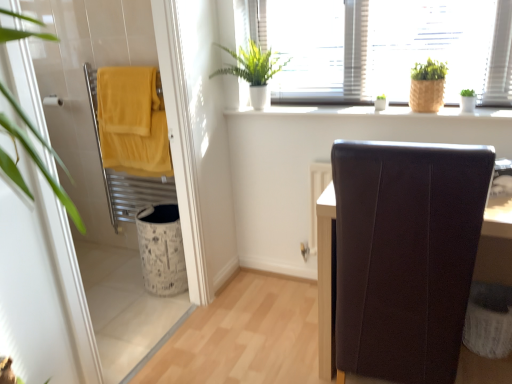
The width and height of the screenshot is (512, 384). Describe the element at coordinates (326, 280) in the screenshot. I see `brown leather chair at right` at that location.

Where is `green matte plant at upper right, the 1th houseplant positioned from the right`? This screenshot has height=384, width=512. green matte plant at upper right, the 1th houseplant positioned from the right is located at coordinates (467, 100).

What is the approximate width of white textured laundry basket at lower right?

white textured laundry basket at lower right is 10.77 inches wide.

Find the location of a particular element. This screenshot has height=384, width=512. white textured laundry basket at lower right is located at coordinates click(489, 320).

Image resolution: width=512 pixels, height=384 pixels. What do you see at coordinates (370, 112) in the screenshot?
I see `white ceramic window sill at upper center` at bounding box center [370, 112].

What do you see at coordinates (86, 91) in the screenshot?
I see `matte yellow towel at left` at bounding box center [86, 91].

Locate an element on the screen. brown leather chair at right is located at coordinates pyautogui.click(x=326, y=280).

Is green leafy plant at upper center, the 3th houseplant positioned from the right, surrounded by green matte plant at upper right, the 1th houseplant positioned from the right?

No, green leafy plant at upper center, the 3th houseplant positioned from the right, is not a part of green matte plant at upper right, the 1th houseplant positioned from the right.

Can you confirm if green matte plant at upper right, the 1th houseplant positioned from the right, is thinner than green leafy plant at upper center, the first houseplant from the left?

Indeed, green matte plant at upper right, the 1th houseplant positioned from the right, has a lesser width compared to green leafy plant at upper center, the first houseplant from the left.

Is there a large distance between green matte plant at upper right, which is the 3th houseplant in left-to-right order, and green leafy plant at upper center, the 3th houseplant positioned from the right?

That's not correct — green matte plant at upper right, which is the 3th houseplant in left-to-right order, is a little close to green leafy plant at upper center, the 3th houseplant positioned from the right.

Is brown leather chair at right further to the viewer compared to matte yellow towel at left?

No, brown leather chair at right is in front of matte yellow towel at left.

How far apart are brown leather chair at right and matte yellow towel at left?

brown leather chair at right is 4.01 feet from matte yellow towel at left.

Does brown leather chair at right touch matte yellow towel at left?

No, brown leather chair at right is not next to matte yellow towel at left.

Is matte yellow towel at left at the back of brown leather chair at right?

brown leather chair at right is not turned away from matte yellow towel at left.

Where is `the 2nd houseplant in front of the green leafy plant at upper center, the first houseplant from the left, starting your count from the anchor`? the 2nd houseplant in front of the green leafy plant at upper center, the first houseplant from the left, starting your count from the anchor is located at coordinates (426, 86).

Considering the sizes of green leafy plant at upper center, the first houseplant from the left, and bamboo textured pot at upper right, acting as the second houseplant starting from the right, in the image, is green leafy plant at upper center, the first houseplant from the left, wider or thinner than bamboo textured pot at upper right, acting as the second houseplant starting from the right,?

Clearly, green leafy plant at upper center, the first houseplant from the left, has more width compared to bamboo textured pot at upper right, acting as the second houseplant starting from the right.

Which point is more forward, (252, 48) or (437, 86)?

The point (437, 86) is in front.

Who is taller, green leafy plant at upper center, the 3th houseplant positioned from the right, or bamboo textured pot at upper right, acting as the second houseplant starting from the right?

Standing taller between the two is green leafy plant at upper center, the 3th houseplant positioned from the right.

Considering the sizes of objects matte yellow towel at left and green matte plant at upper right, the 1th houseplant positioned from the right, in the image provided, who is taller, matte yellow towel at left or green matte plant at upper right, the 1th houseplant positioned from the right,?

Standing taller between the two is matte yellow towel at left.

From a real-world perspective, does matte yellow towel at left sit lower than green matte plant at upper right, which is the 3th houseplant in left-to-right order?

Correct, in the physical world, matte yellow towel at left is lower than green matte plant at upper right, which is the 3th houseplant in left-to-right order.

Is matte yellow towel at left oriented towards green matte plant at upper right, which is the 3th houseplant in left-to-right order?

No, matte yellow towel at left does not turn towards green matte plant at upper right, which is the 3th houseplant in left-to-right order.

Considering the sizes of objects matte yellow towel at left and green matte plant at upper right, which is the 3th houseplant in left-to-right order, in the image provided, who is smaller, matte yellow towel at left or green matte plant at upper right, which is the 3th houseplant in left-to-right order,?

green matte plant at upper right, which is the 3th houseplant in left-to-right order, is smaller.

Does point (102, 353) appear closer or farther from the camera than point (437, 96)?

Point (102, 353) is positioned farther from the camera compared to point (437, 96).

The image size is (512, 384). What are the coordinates of `the 2nd houseplant to the right of the matte yellow towel at left, counting from the anchor's position` in the screenshot? It's located at (426, 86).

Is matte yellow towel at left facing away from bamboo textured pot at upper right, acting as the second houseplant starting from the right?

No, bamboo textured pot at upper right, acting as the second houseplant starting from the right, is not at the back of matte yellow towel at left.

How many degrees apart are the facing directions of brown leather chair at right and white ceramic window sill at upper center?

The angle between the facing direction of brown leather chair at right and the facing direction of white ceramic window sill at upper center is 2.03 degrees.

Looking at this image, how distant is brown leather chair at right from white ceramic window sill at upper center?

brown leather chair at right and white ceramic window sill at upper center are 74.69 centimeters apart.

Considering the sizes of objects brown leather chair at right and white ceramic window sill at upper center in the image provided, who is thinner, brown leather chair at right or white ceramic window sill at upper center?

With smaller width is white ceramic window sill at upper center.

From a real-world perspective, is brown leather chair at right physically located above or below white ceramic window sill at upper center?

brown leather chair at right is situated lower than white ceramic window sill at upper center in the real world.

Does green leafy plant at upper center, the 3th houseplant positioned from the right, turn towards matte yellow towel at left?

Yes, green leafy plant at upper center, the 3th houseplant positioned from the right, is turned towards matte yellow towel at left.

Do you think green leafy plant at upper center, the 3th houseplant positioned from the right, is within matte yellow towel at left, or outside of it?

green leafy plant at upper center, the 3th houseplant positioned from the right, is not enclosed by matte yellow towel at left.

Considering the sizes of green leafy plant at upper center, the first houseplant from the left, and matte yellow towel at left in the image, is green leafy plant at upper center, the first houseplant from the left, taller or shorter than matte yellow towel at left?

Clearly, green leafy plant at upper center, the first houseplant from the left, is shorter compared to matte yellow towel at left.

Is green leafy plant at upper center, the 3th houseplant positioned from the right, positioned behind matte yellow towel at left?

Yes, green leafy plant at upper center, the 3th houseplant positioned from the right, is further from the camera.

The height and width of the screenshot is (384, 512). What are the coordinates of `houseplant that is the 2nd object located above the green matte plant at upper right, which is the 3th houseplant in left-to-right order (from the image's perspective)` in the screenshot? It's located at (253, 71).

Identify the location of furniture that appears in front of the matte yellow towel at left. This screenshot has width=512, height=384. (326, 280).

Looking at the image, which one is located further to bamboo textured pot at upper right, the second houseplant viewed from the left, white textured laundry basket at lower right or white ceramic window sill at upper center?

white textured laundry basket at lower right lies further to bamboo textured pot at upper right, the second houseplant viewed from the left, than the other object.

Which object lies further to the anchor point matte yellow towel at left, brown leather chair at right or matte yellow towel at left?

brown leather chair at right.

Considering their positions, is bamboo textured pot at upper right, the second houseplant viewed from the left, positioned further to green matte plant at upper right, which is the 3th houseplant in left-to-right order, than matte yellow towel at left?

Based on the image, matte yellow towel at left appears to be further to green matte plant at upper right, which is the 3th houseplant in left-to-right order.

Which object lies further to the anchor point green leafy plant at upper center, the first houseplant from the left, brown leather chair at right or matte yellow towel at left?

brown leather chair at right.

From the image, which object appears to be nearer to green leafy plant at upper center, the first houseplant from the left, matte yellow towel at left or white textured laundry basket at lower right?

matte yellow towel at left.

Which object lies nearer to the anchor point matte yellow towel at left, green matte plant at upper right, the 1th houseplant positioned from the right, or white ceramic window sill at upper center?

white ceramic window sill at upper center is closer to matte yellow towel at left.

Looking at the image, which one is located closer to white ceramic window sill at upper center, matte yellow towel at left or matte yellow towel at left?

matte yellow towel at left is positioned closer to the anchor white ceramic window sill at upper center.

From the image, which object appears to be nearer to green matte plant at upper right, which is the 3th houseplant in left-to-right order, white textured laundry basket at lower right or white ceramic window sill at upper center?

Among the two, white ceramic window sill at upper center is located nearer to green matte plant at upper right, which is the 3th houseplant in left-to-right order.

This screenshot has height=384, width=512. Identify the location of window sill between matte yellow towel at left and white textured laundry basket at lower right from left to right. (370, 112).

At what (x,y) coordinates should I click in order to perform the action: click on houseplant between bamboo textured pot at upper right, acting as the second houseplant starting from the right, and brown leather chair at right from top to bottom. Please return your answer as a coordinate pair (x, y). Looking at the image, I should click on click(467, 100).

Where is `houseplant between matte yellow towel at left and white ceramic window sill at upper center in the horizontal direction`? Image resolution: width=512 pixels, height=384 pixels. houseplant between matte yellow towel at left and white ceramic window sill at upper center in the horizontal direction is located at coordinates (253, 71).

In order to click on window sill situated between matte yellow towel at left and green matte plant at upper right, the 1th houseplant positioned from the right, from left to right in this screenshot , I will do `click(370, 112)`.